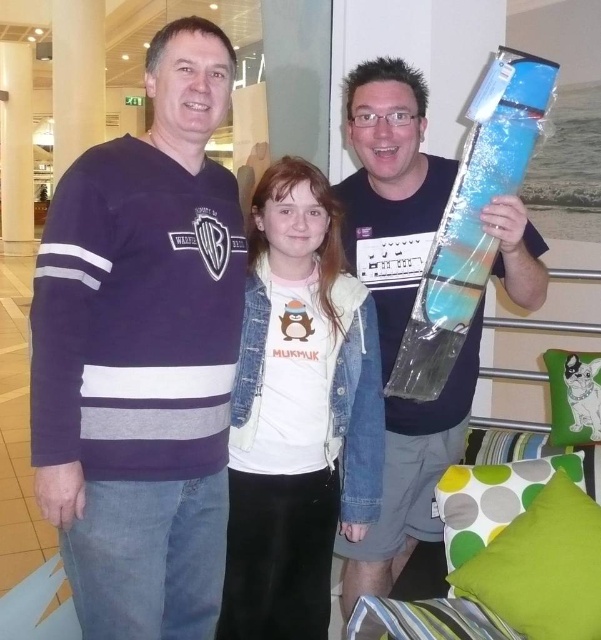
You are standing in the shopping mall and see two points marked on the floor. The first point is at coordinate point [165,566] and the second point is at coordinate point [322,557]. If you are facing the direction of the railing and decorative pillows, which point is closer to you?

Point [165,566] is in front of point [322,557], so if you are facing the direction of the railing and decorative pillows, the point closer to you would be point [165,566].

Consider the image. You are a store clerk arranging items on a shelf. You have a purple jersey at left and a blue plastic guitar at center. The shelf has a space that can only accommodate items narrower than 30 cm. Which item should you place first to ensure it fits?

The purple jersey at left should be placed first because its width is less than the blue plastic guitar at center, making it more likely to fit within the 30 cm space.